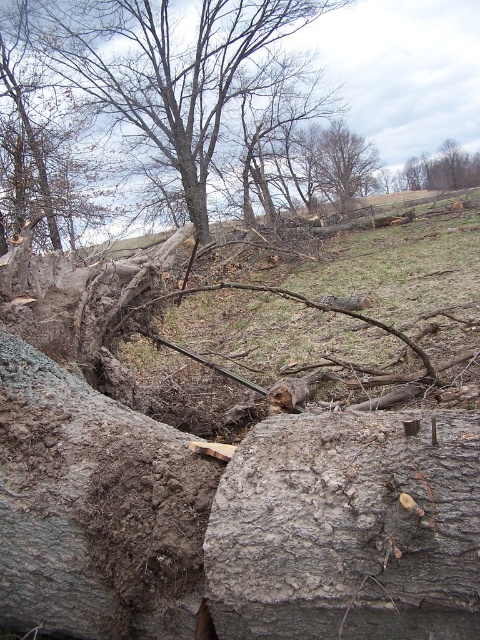
Measure the distance between brown rough tree at upper center and smooth bark tree at upper right.

A distance of 16.80 feet exists between brown rough tree at upper center and smooth bark tree at upper right.

Between point (368, 148) and point (456, 157), which one is positioned behind?

Point (456, 157)

Is point (342, 129) farther from camera compared to point (420, 157)?

No.

Where is `brown rough tree at upper center`? brown rough tree at upper center is located at coordinates tap(339, 163).

Is gray rough log at center above gray rough boulder at center?

Indeed, gray rough log at center is positioned over gray rough boulder at center.

Between point (339, 637) and point (92, 593), which one is positioned in front?

Positioned in front is point (339, 637).

Where is `gray rough log at center`? gray rough log at center is located at coordinates (348, 529).

Which is below, gray rough boulder at center or brown bark tree at upper left?

gray rough boulder at center is below.

Does gray rough boulder at center have a lesser width compared to brown bark tree at upper left?

Correct, gray rough boulder at center's width is less than brown bark tree at upper left's.

Identify the location of gray rough boulder at center. (94, 508).